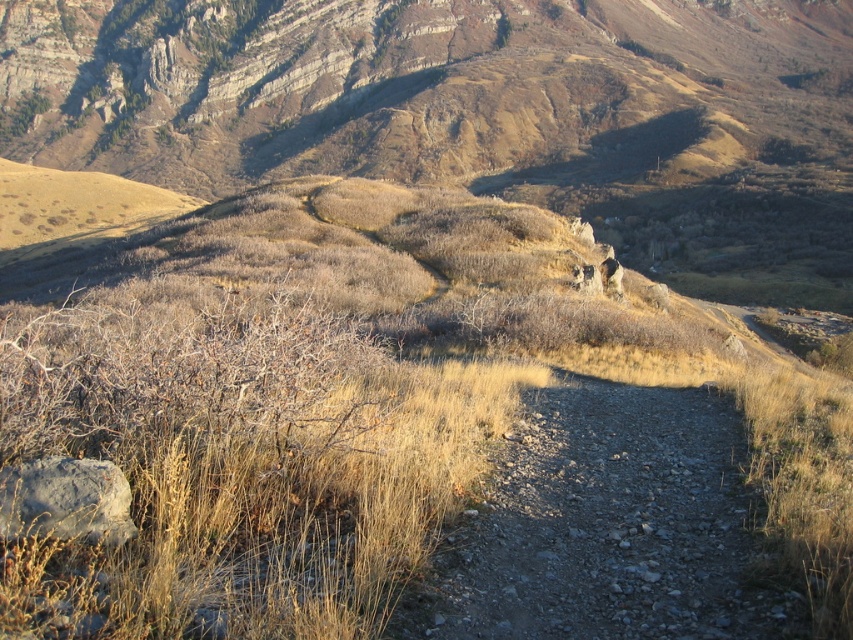
Question: Does dry grass at center appear over dusty gravel path at center?

Choices:
 (A) no
 (B) yes

Answer: (B)

Question: Does dry grass at center have a lesser width compared to dusty gravel path at center?

Choices:
 (A) no
 (B) yes

Answer: (A)

Question: Which point is farther to the camera?

Choices:
 (A) dusty gravel path at center
 (B) dry grass at center

Answer: (A)

Question: Is dry grass at center below dusty gravel path at center?

Choices:
 (A) yes
 (B) no

Answer: (B)

Question: Which object appears closest to the camera in this image?

Choices:
 (A) dry grass at center
 (B) dusty gravel path at center

Answer: (A)